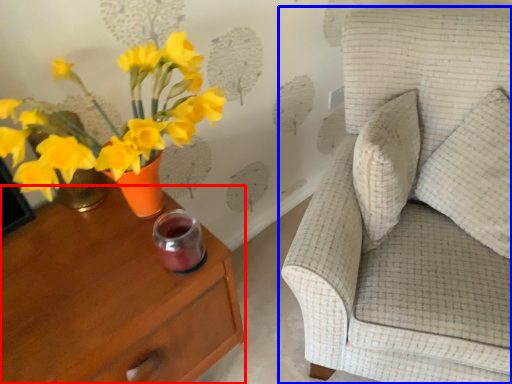
Question: Which point is closer to the camera, nightstand (highlighted by a red box) or chair (highlighted by a blue box)?

Choices:
 (A) nightstand
 (B) chair

Answer: (B)